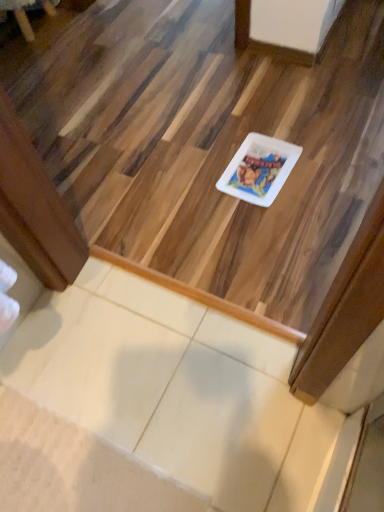
The height and width of the screenshot is (512, 384). I want to click on free point behind white glossy plate at center, so click(248, 125).